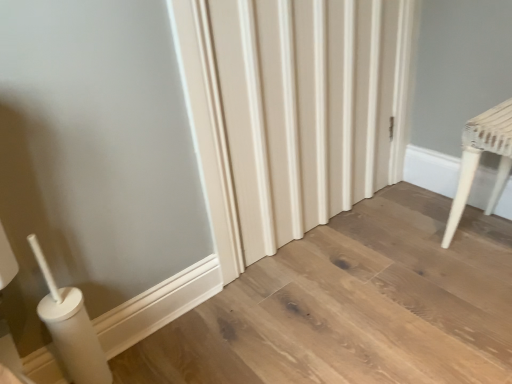
Find the location of `free space below white woven stool at right (from a real-world perspective)`. free space below white woven stool at right (from a real-world perspective) is located at coordinates (490, 241).